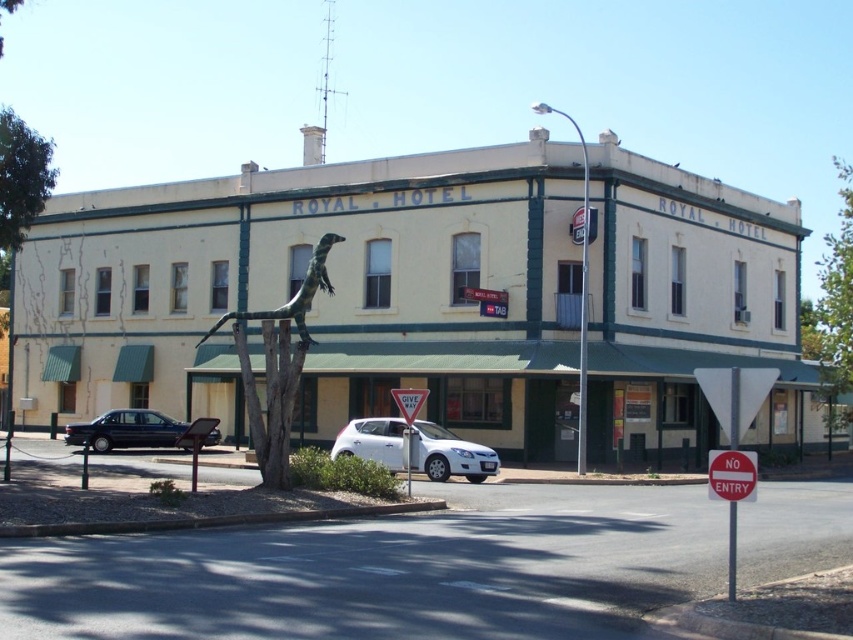
You are a guest arriving at the Royal Hotel and see the matte black sedan at left and the red plastic sign at center. Which object is closer to the entrance of the hotel?

The red plastic sign at center is closer to the entrance of the hotel because the matte black sedan at left is positioned on the left side of it, meaning the sign is between the sedan and the entrance.